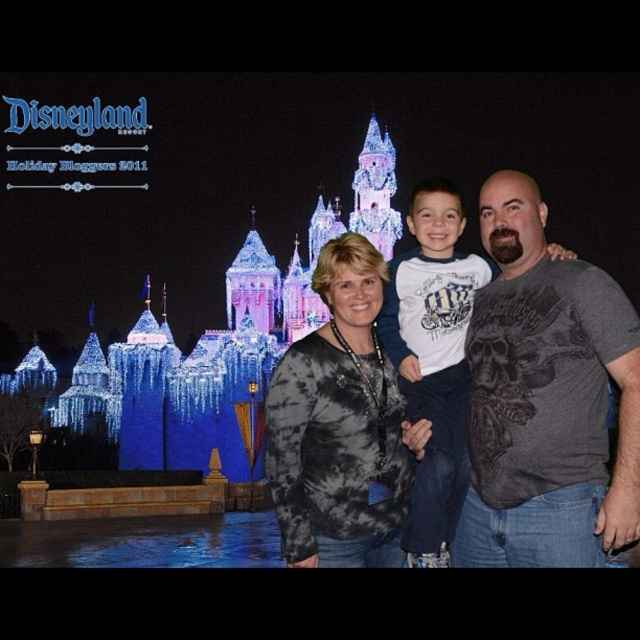
You are standing at the point marked by the coordinates point (500, 445) and want to take a photo of the Sleeping Beauty Castle. Since you know the distance between you and the viewer is 300.41 feet, can you estimate whether the castle will be in focus if your camera has a depth of field of 250 feet?

The distance between you at point (500, 445) and the viewer is 300.41 feet. Since the camera has a depth of field of 250 feet, the castle may not be in focus as the distance exceeds the depth of field capability.